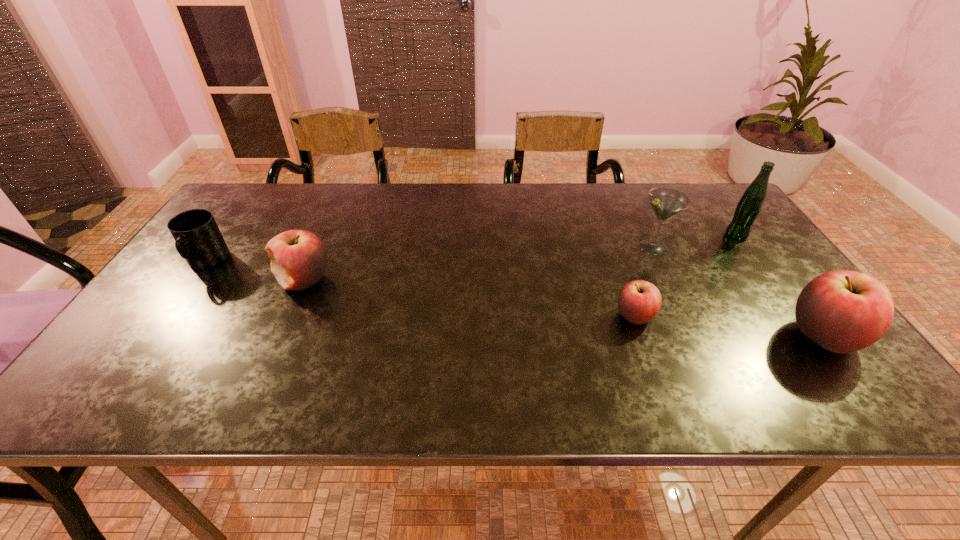
I want to click on free region that satisfies the following two spatial constraints: 1. on the side of the mug with the handle; 2. on the left side of the rightmost apple, so [x=154, y=337].